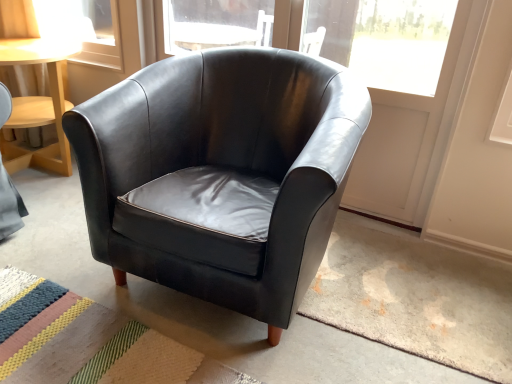
Question: Considering the relative sizes of striped woven mat at lower left and black leather armchair at center in the image provided, is striped woven mat at lower left smaller than black leather armchair at center?

Choices:
 (A) no
 (B) yes

Answer: (B)

Question: Does striped woven mat at lower left have a greater height compared to black leather armchair at center?

Choices:
 (A) no
 (B) yes

Answer: (A)

Question: Is striped woven mat at lower left bigger than black leather armchair at center?

Choices:
 (A) no
 (B) yes

Answer: (A)

Question: Does striped woven mat at lower left turn towards black leather armchair at center?

Choices:
 (A) yes
 (B) no

Answer: (B)

Question: Is striped woven mat at lower left oriented away from black leather armchair at center?

Choices:
 (A) no
 (B) yes

Answer: (A)

Question: From a real-world perspective, is striped woven mat at lower left physically above black leather armchair at center?

Choices:
 (A) no
 (B) yes

Answer: (A)

Question: Is the position of black leather armchair at center more distant than that of striped woven mat at lower left?

Choices:
 (A) no
 (B) yes

Answer: (A)

Question: Is black leather armchair at center smaller than striped woven mat at lower left?

Choices:
 (A) no
 (B) yes

Answer: (A)

Question: From the image's perspective, is black leather armchair at center on striped woven mat at lower left?

Choices:
 (A) no
 (B) yes

Answer: (B)

Question: Does black leather armchair at center have a greater width compared to striped woven mat at lower left?

Choices:
 (A) yes
 (B) no

Answer: (B)

Question: Can striped woven mat at lower left be found inside black leather armchair at center?

Choices:
 (A) no
 (B) yes

Answer: (A)

Question: Can you confirm if black leather armchair at center is thinner than striped woven mat at lower left?

Choices:
 (A) yes
 (B) no

Answer: (A)

Question: Choose the correct answer: Is striped woven mat at lower left inside black leather armchair at center or outside it?

Choices:
 (A) inside
 (B) outside

Answer: (B)